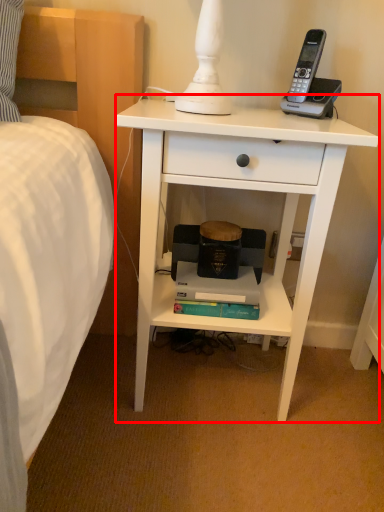
Question: From the image's perspective, what is the correct spatial relationship of nightstand (annotated by the red box) in relation to paperback book?

Choices:
 (A) above
 (B) below

Answer: (A)